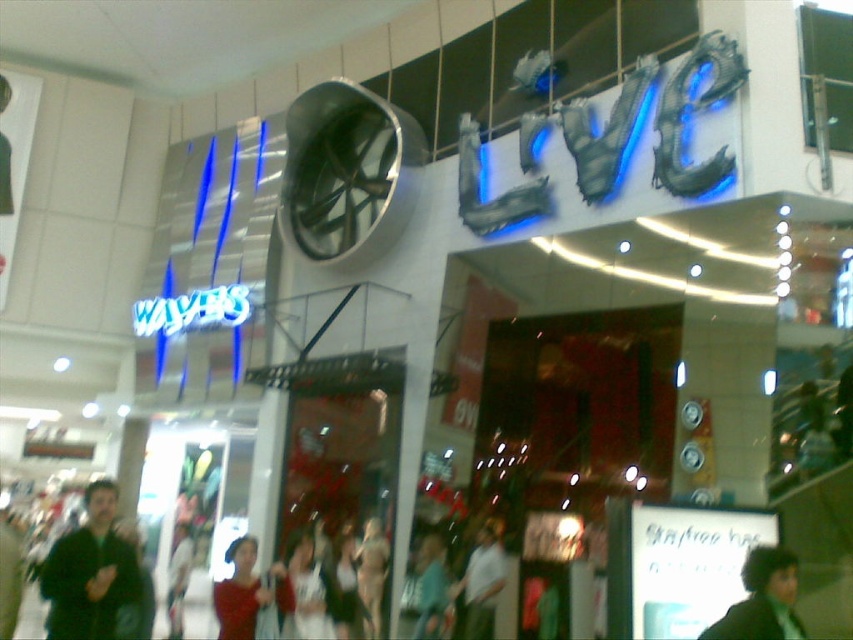
Does dark brown hair at lower right appear on the right side of white fabric dress at center?

Indeed, dark brown hair at lower right is positioned on the right side of white fabric dress at center.

Describe the element at coordinates (762, 600) in the screenshot. The height and width of the screenshot is (640, 853). I see `dark brown hair at lower right` at that location.

Where is `dark brown hair at lower right`? This screenshot has width=853, height=640. dark brown hair at lower right is located at coordinates (762, 600).

Consider the image. Between dark green jacket at lower left and white matte shirt at center, which one appears on the left side from the viewer's perspective?

dark green jacket at lower left is more to the left.

Does dark green jacket at lower left appear under white matte shirt at center?

No, dark green jacket at lower left is not below white matte shirt at center.

Is point (100, 592) closer to viewer compared to point (474, 596)?

That is True.

You are a GUI agent. You are given a task and a screenshot of the screen. Output one action in this format:
    pyautogui.click(x=<x>, y=<y>)
    Task: Click on the dark green jacket at lower left
    The height and width of the screenshot is (640, 853).
    Given the screenshot: What is the action you would take?
    pyautogui.click(x=90, y=572)

Locate an element on the screen. dark brown hair at lower right is located at coordinates (762, 600).

This screenshot has height=640, width=853. Describe the element at coordinates (762, 600) in the screenshot. I see `dark brown hair at lower right` at that location.

At what (x,y) coordinates should I click in order to perform the action: click on dark brown hair at lower right. Please return your answer as a coordinate pair (x, y). This screenshot has width=853, height=640. Looking at the image, I should click on (762, 600).